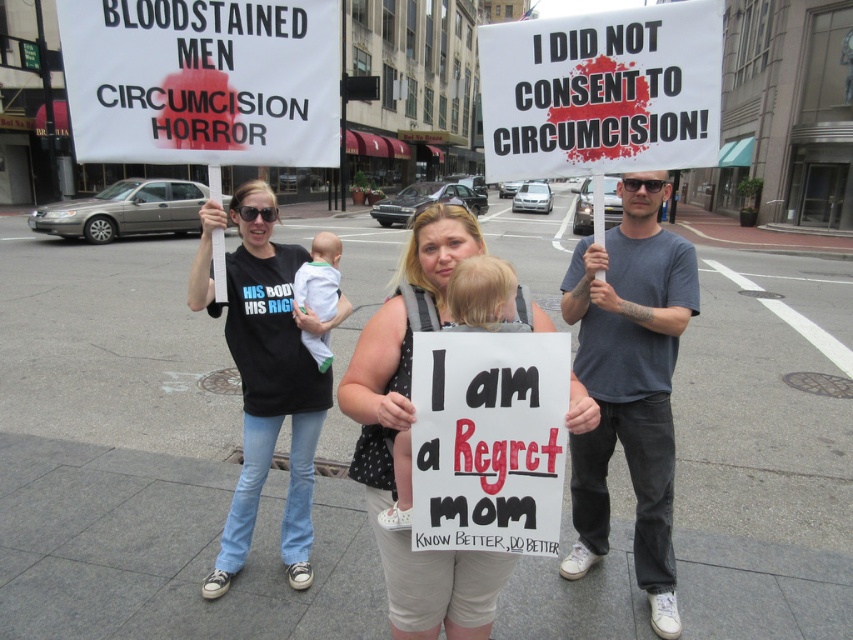
Question: Which object is farther from the camera taking this photo?

Choices:
 (A) black cotton t-shirt at center
 (B) dark gray t-shirt at center
 (C) white cotton baby at center
 (D) white paper sign at center

Answer: (C)

Question: Which of the following is the closest to the observer?

Choices:
 (A) soft beige fabric baby at center
 (B) white cotton shirt at center
 (C) dark gray t-shirt at center
 (D) black cotton t-shirt at center

Answer: (A)

Question: Does soft beige fabric baby at center lie in front of white cotton baby at center?

Choices:
 (A) no
 (B) yes

Answer: (B)

Question: Does white paper sign at upper left appear on the left side of white cotton baby at center?

Choices:
 (A) yes
 (B) no

Answer: (A)

Question: Can you confirm if white paper sign at center is positioned above soft beige fabric baby at center?

Choices:
 (A) no
 (B) yes

Answer: (B)

Question: Which is nearer to the soft beige fabric baby at center?

Choices:
 (A) white cotton shirt at center
 (B) dark gray t-shirt at center

Answer: (A)